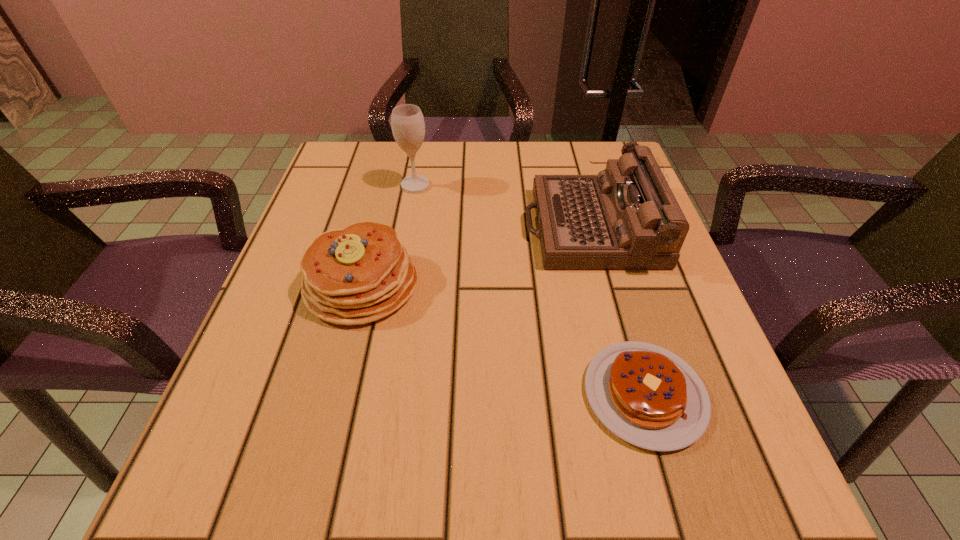
Image resolution: width=960 pixels, height=540 pixels. Identify the location of free space between the shorter pancake and the tallest object. (530, 290).

Find the location of `vacant space that's between the tallest object and the nearer pancake`. vacant space that's between the tallest object and the nearer pancake is located at coordinates (530, 290).

Find the location of a particular element. The image size is (960, 540). vacant region between the shorter pancake and the third shortest object is located at coordinates (617, 310).

Identify the location of free space that is in between the right pancake and the typewriter. This screenshot has width=960, height=540. (617, 310).

The image size is (960, 540). What are the coordinates of `vacant space in between the shorter pancake and the taller pancake` in the screenshot? It's located at (503, 340).

Identify which object is located as the second nearest to the wineglass. Please provide its 2D coordinates. Your answer should be formatted as a tuple, i.e. [(x, y)], where the tuple contains the x and y coordinates of a point satisfying the conditions above.

[(625, 218)]

Image resolution: width=960 pixels, height=540 pixels. Find the location of `object identified as the closest to the second shortest object`. object identified as the closest to the second shortest object is located at coordinates (408, 127).

Find the location of a particular element. vacant area that satisfies the following two spatial constraints: 1. on the keyboard of the shorter pancake; 2. on the right side of the third shortest object is located at coordinates (636, 395).

The width and height of the screenshot is (960, 540). I want to click on free spot that satisfies the following two spatial constraints: 1. on the back side of the left pancake; 2. on the left side of the tallest object, so click(387, 185).

At what (x,y) coordinates should I click in order to perform the action: click on free point that satisfies the following two spatial constraints: 1. on the back side of the shortest object; 2. on the keyboard of the second tallest object. Please return your answer as a coordinate pair (x, y). Looking at the image, I should click on (596, 227).